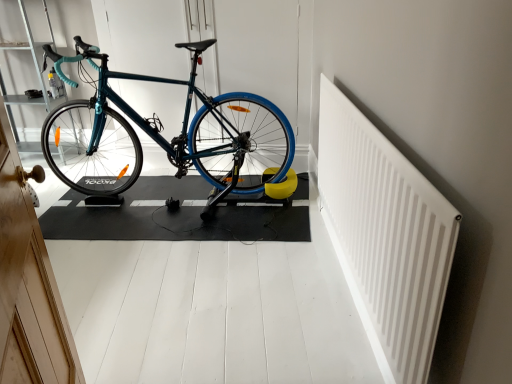
Question: Is teal glossy bicycle at center taller than white plastic radiator at upper right?

Choices:
 (A) yes
 (B) no

Answer: (A)

Question: Is teal glossy bicycle at center positioned far away from white plastic radiator at upper right?

Choices:
 (A) yes
 (B) no

Answer: (A)

Question: Is teal glossy bicycle at center in front of white plastic radiator at upper right?

Choices:
 (A) yes
 (B) no

Answer: (B)

Question: From a real-world perspective, is teal glossy bicycle at center beneath white plastic radiator at upper right?

Choices:
 (A) yes
 (B) no

Answer: (B)

Question: Does teal glossy bicycle at center have a greater width compared to white plastic radiator at upper right?

Choices:
 (A) yes
 (B) no

Answer: (A)

Question: Looking at the image, does teal glossy bicycle at center seem bigger or smaller compared to white plastic radiator at upper right?

Choices:
 (A) small
 (B) big

Answer: (B)

Question: Considering the positions of teal glossy bicycle at center and white plastic radiator at upper right in the image, is teal glossy bicycle at center wider or thinner than white plastic radiator at upper right?

Choices:
 (A) wide
 (B) thin

Answer: (A)

Question: In the image, is teal glossy bicycle at center on the left side or the right side of white plastic radiator at upper right?

Choices:
 (A) right
 (B) left

Answer: (B)

Question: Is teal glossy bicycle at center in front of or behind white plastic radiator at upper right in the image?

Choices:
 (A) behind
 (B) front

Answer: (A)

Question: Is point (74, 8) positioned closer to the camera than point (334, 158)?

Choices:
 (A) farther
 (B) closer

Answer: (A)

Question: Looking at their shapes, would you say teal matte bicycle handlebar at upper left is wider or thinner than white plastic radiator at upper right?

Choices:
 (A) wide
 (B) thin

Answer: (A)

Question: From a real-world perspective, relative to white plastic radiator at upper right, is teal matte bicycle handlebar at upper left vertically above or below?

Choices:
 (A) below
 (B) above

Answer: (B)

Question: From their relative heights in the image, would you say teal matte bicycle handlebar at upper left is taller or shorter than white plastic radiator at upper right?

Choices:
 (A) tall
 (B) short

Answer: (A)

Question: Would you say teal glossy bicycle at center is to the left or to the right of teal matte bicycle handlebar at upper left in the picture?

Choices:
 (A) right
 (B) left

Answer: (A)

Question: From a real-world perspective, relative to teal matte bicycle handlebar at upper left, is teal glossy bicycle at center vertically above or below?

Choices:
 (A) above
 (B) below

Answer: (B)